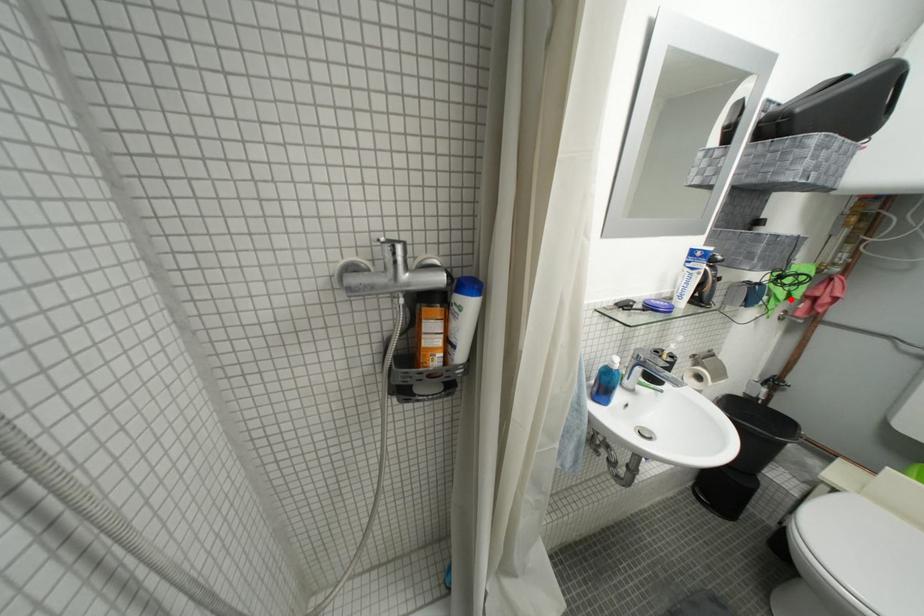
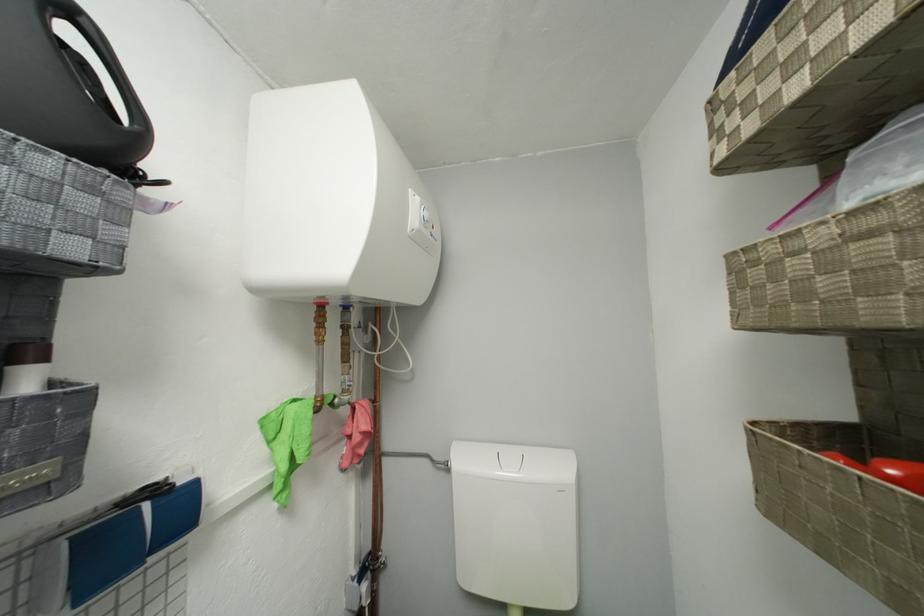
The point at the highlighted location is marked in the first image. Where is the corresponding point in the second image?

(293, 469)